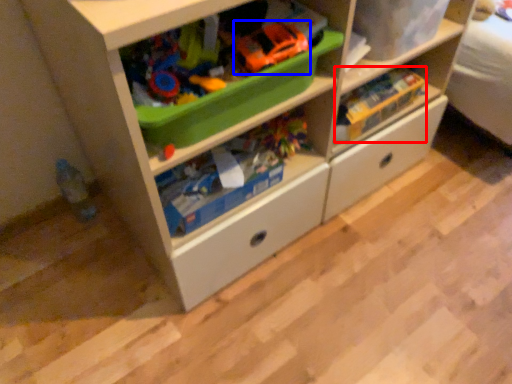
Question: Which object is closer to the camera taking this photo, toy (highlighted by a red box) or toy car (highlighted by a blue box)?

Choices:
 (A) toy
 (B) toy car

Answer: (B)